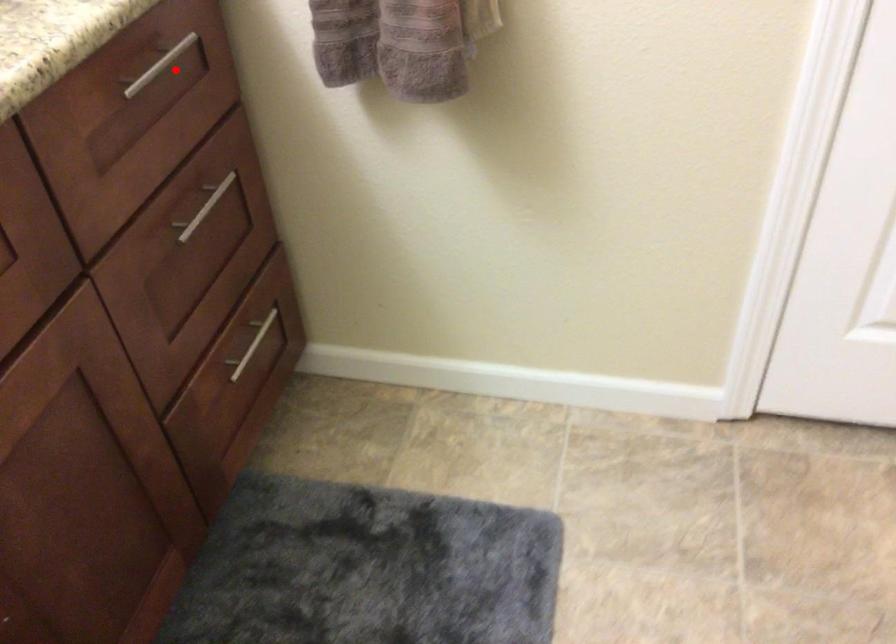
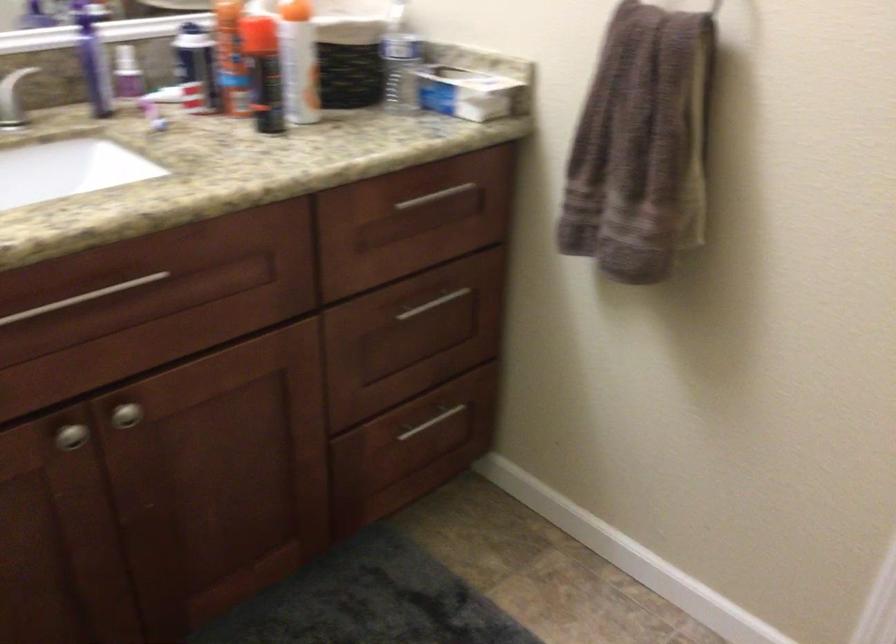
Question: I am providing you with two images of the same scene from different viewpoints. A red point is shown in image1. For the corresponding object point in image2, is it positioned nearer or farther from the camera?

Choices:
 (A) Nearer
 (B) Farther

Answer: (B)